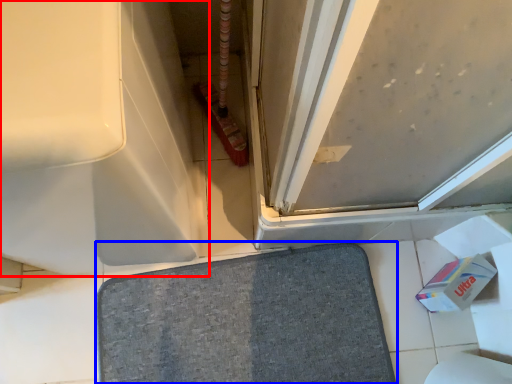
Question: Which object is further to the camera taking this photo, bath (highlighted by a red box) or bath mat (highlighted by a blue box)?

Choices:
 (A) bath
 (B) bath mat

Answer: (B)